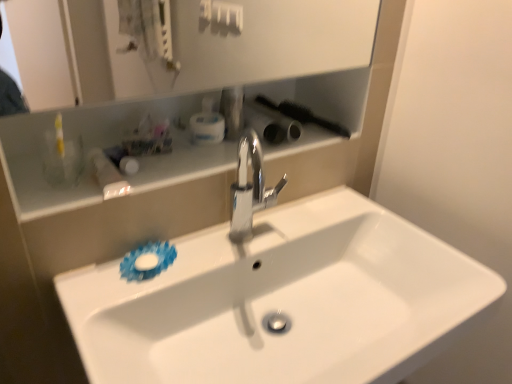
Question: From the image's perspective, is white glossy sink at center above or below polished chrome faucet at center?

Choices:
 (A) above
 (B) below

Answer: (B)

Question: Does point (117, 264) appear closer or farther from the camera than point (239, 142)?

Choices:
 (A) farther
 (B) closer

Answer: (B)

Question: Which object is the farthest from the white plastic container at upper center, arranged as the 2th toiletry when viewed from the right?

Choices:
 (A) white glossy sink at center
 (B) white glossy shelf at upper center
 (C) polished chrome faucet at center
 (D) metallic silver faucet at center, arranged as the third toiletry when viewed from the left
 (E) white glossy bottle at upper left, placed as the 1th toiletry when sorted from left to right

Answer: (A)

Question: Which object is the farthest from the white plastic container at upper center, positioned as the second toiletry in left-to-right order?

Choices:
 (A) white glossy bottle at upper left, placed as the 1th toiletry when sorted from left to right
 (B) metallic silver faucet at center, the 1th toiletry from the right
 (C) polished chrome faucet at center
 (D) white glossy sink at center
 (E) white glossy shelf at upper center

Answer: (D)